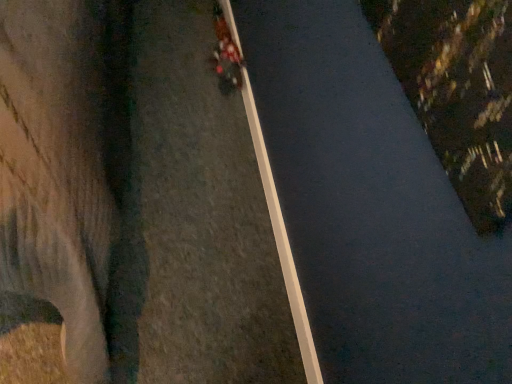
Question: Considering the positions of white smooth curb at center and metallic red motorcycle at center in the image, is white smooth curb at center bigger or smaller than metallic red motorcycle at center?

Choices:
 (A) big
 (B) small

Answer: (B)

Question: Is point (241, 51) closer or farther from the camera than point (214, 11)?

Choices:
 (A) farther
 (B) closer

Answer: (B)

Question: From a real-world perspective, relative to metallic red motorcycle at center, is white smooth curb at center vertically above or below?

Choices:
 (A) below
 (B) above

Answer: (A)

Question: Would you say metallic red motorcycle at center is inside or outside white smooth curb at center?

Choices:
 (A) outside
 (B) inside

Answer: (A)

Question: Based on their positions, is metallic red motorcycle at center located to the left or right of white smooth curb at center?

Choices:
 (A) left
 (B) right

Answer: (A)

Question: Considering their positions, is metallic red motorcycle at center located in front of or behind white smooth curb at center?

Choices:
 (A) front
 (B) behind

Answer: (B)

Question: From a real-world perspective, is metallic red motorcycle at center positioned above or below white smooth curb at center?

Choices:
 (A) below
 (B) above

Answer: (B)